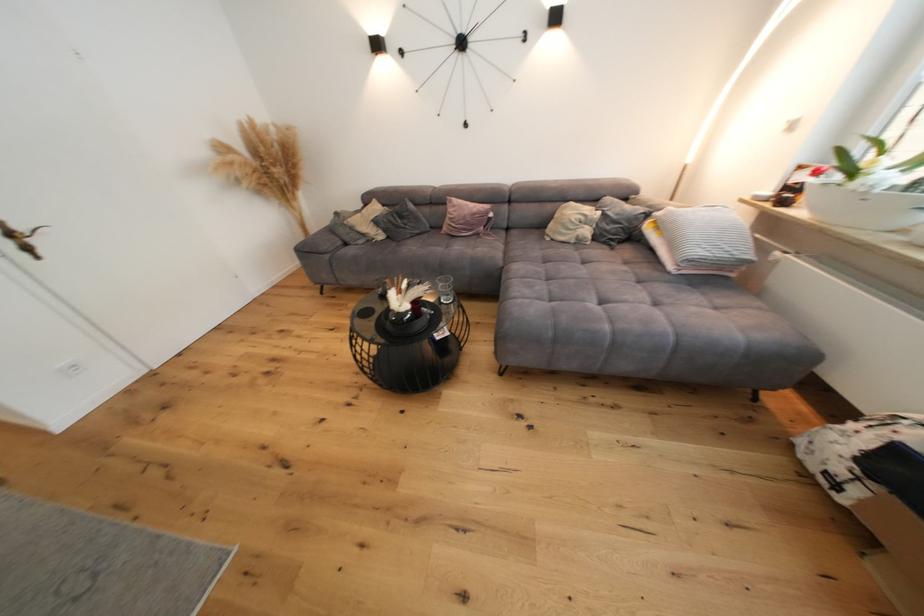
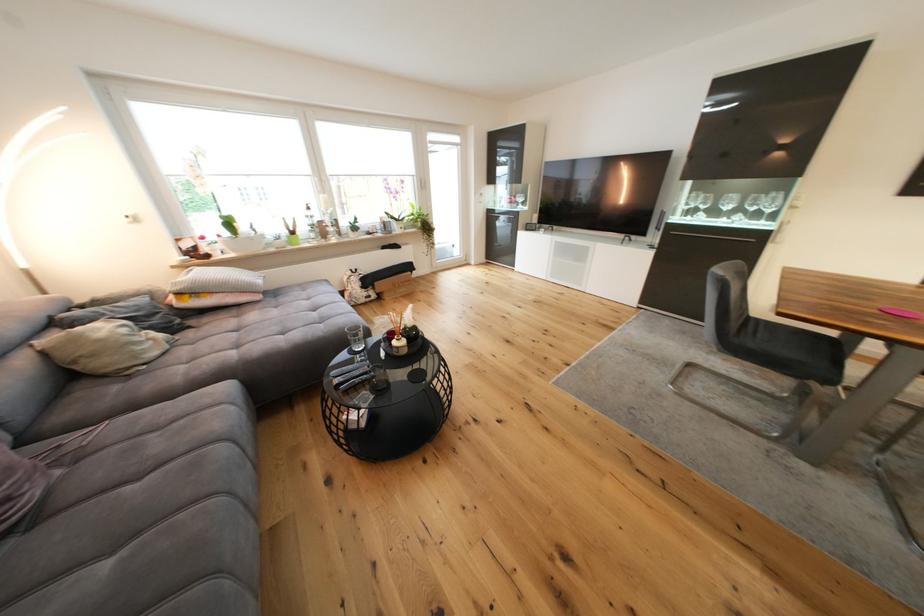
In the second image, find the point that corresponds to (593,233) in the first image.

(161, 336)